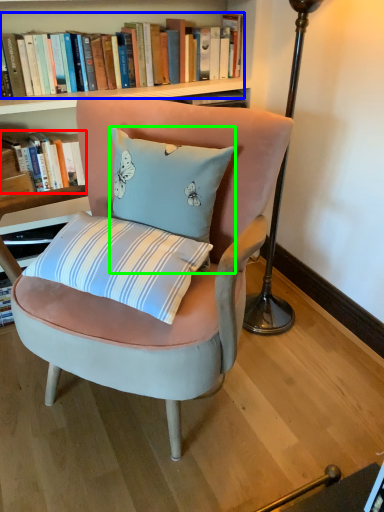
Question: Which object is positioned closest to book (highlighted by a red box)? Select from book (highlighted by a blue box) and pillow (highlighted by a green box).

Choices:
 (A) book
 (B) pillow

Answer: (A)